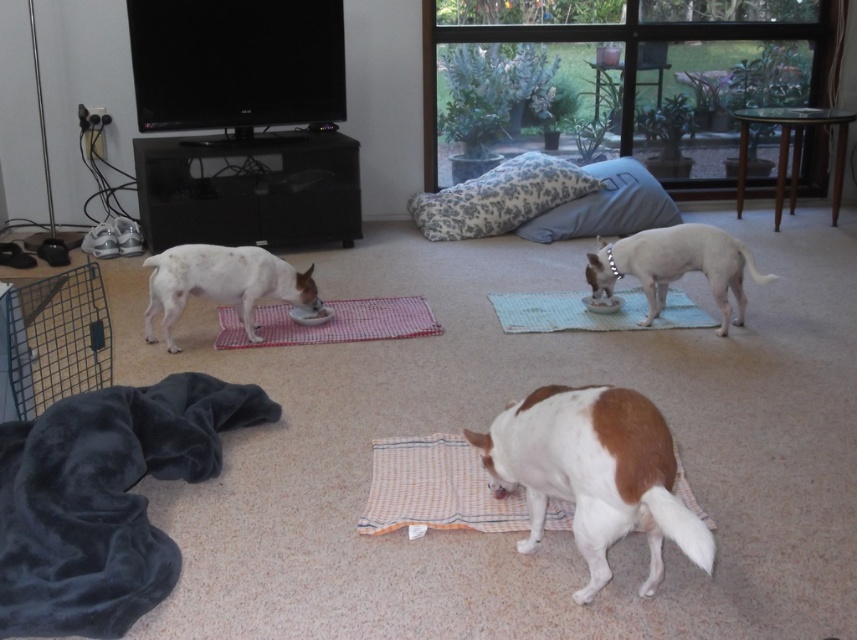
Who is more distant from viewer, (55,342) or (478,208)?

Positioned behind is point (478,208).

Which is more to the right, metal wire cage at left or fluffy white pillow at center?

From the viewer's perspective, fluffy white pillow at center appears more on the right side.

The height and width of the screenshot is (640, 857). What do you see at coordinates (57, 339) in the screenshot?
I see `metal wire cage at left` at bounding box center [57, 339].

The height and width of the screenshot is (640, 857). In order to click on metal wire cage at left in this screenshot , I will do `click(57, 339)`.

Does metal wire cage at left have a lesser width compared to white smooth dog at center?

Incorrect, metal wire cage at left's width is not less than white smooth dog at center's.

Between metal wire cage at left and white smooth dog at center, which one is positioned higher?

white smooth dog at center

Describe the element at coordinates (57, 339) in the screenshot. The width and height of the screenshot is (857, 640). I see `metal wire cage at left` at that location.

Where is `metal wire cage at left`? The image size is (857, 640). metal wire cage at left is located at coordinates (57, 339).

Which is behind, point (235, 253) or point (423, 305)?

Positioned behind is point (423, 305).

This screenshot has height=640, width=857. In order to click on white speckled fur at left in this screenshot , I will do `click(220, 284)`.